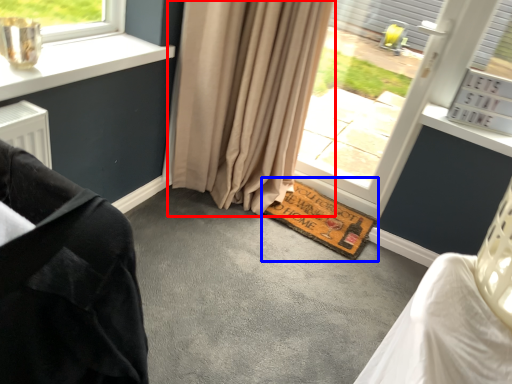
Question: Which object is closer to the camera taking this photo, curtain (highlighted by a red box) or doormat (highlighted by a blue box)?

Choices:
 (A) curtain
 (B) doormat

Answer: (A)